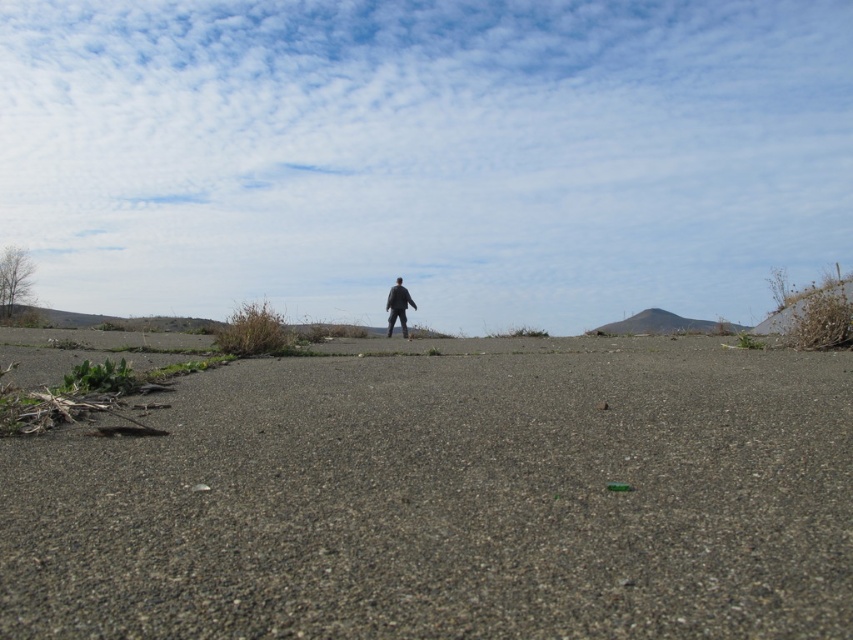
In the scene shown: You are standing on the paved area and see the gray gravelly dirt at center and the black matte jacket at center. Which object is closer to the ground?

The gray gravelly dirt at center is closer to the ground as it is located below the black matte jacket at center.

You are standing on the paved area in the foreground of the image and want to walk to the gray gravelly dirt at center. Which direction should you move in to reach it?

The gray gravelly dirt at center is located at point (x=450, y=499), so you should move towards the center of the image to reach it.